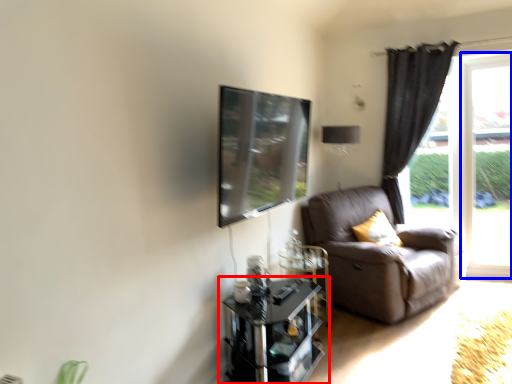
Question: Which point is further to the camera, table (highlighted by a red box) or window frame (highlighted by a blue box)?

Choices:
 (A) table
 (B) window frame

Answer: (B)